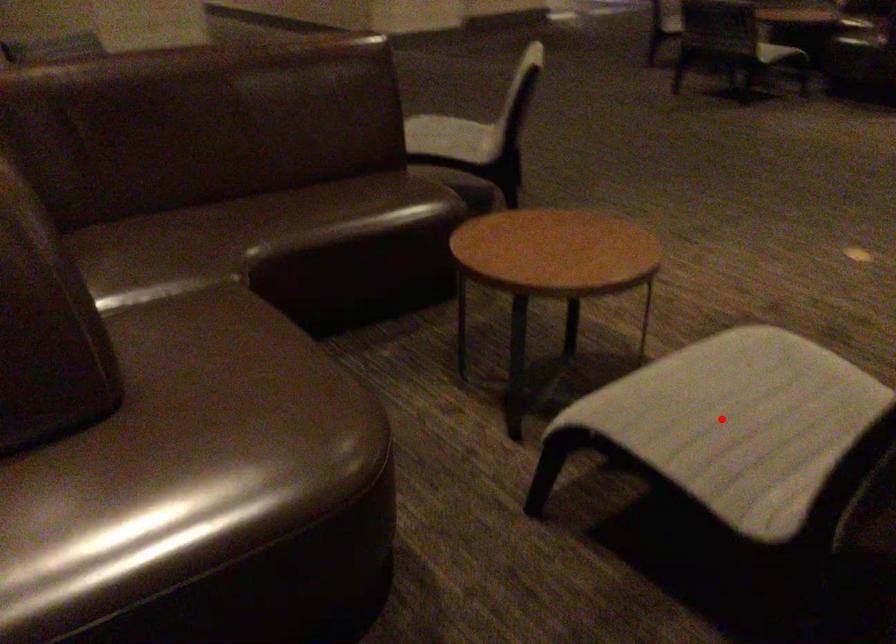
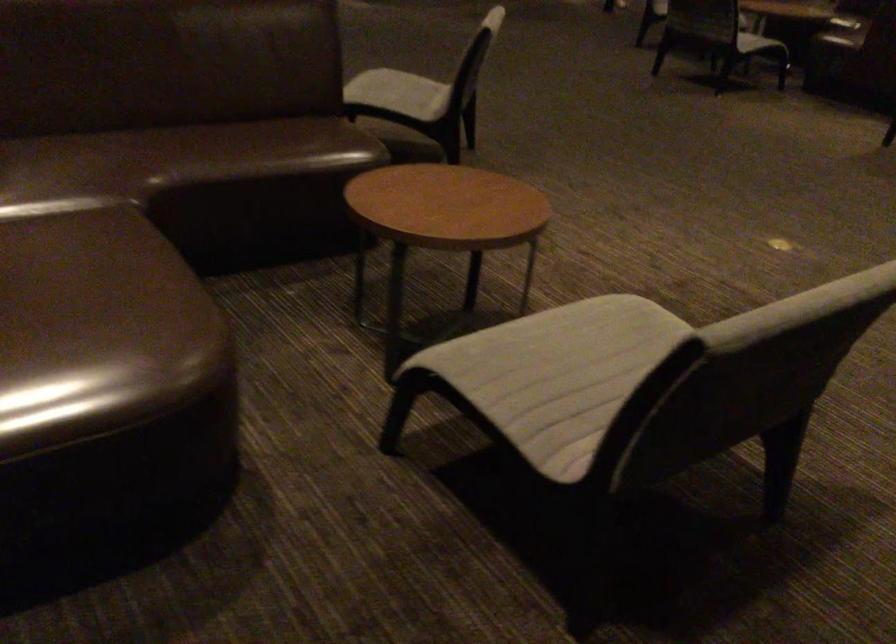
Question: I am providing you with two images of the same scene from different viewpoints. A red point is marked on the first image. At the location where the point appears in image 1, is it still visible in image 2?

Choices:
 (A) Yes
 (B) No

Answer: (A)